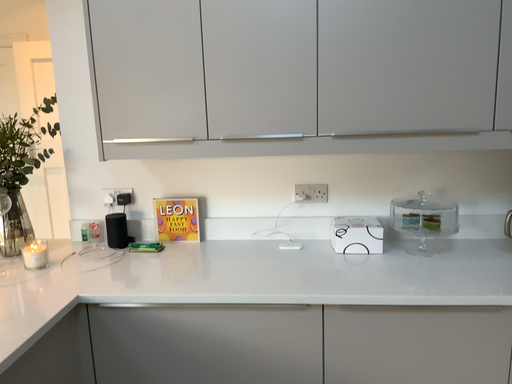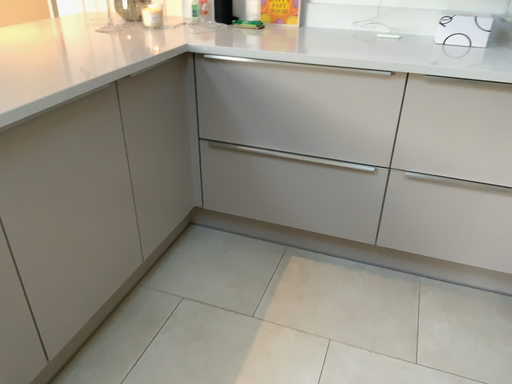
Question: Which way did the camera rotate in the video?

Choices:
 (A) rotated left
 (B) rotated right

Answer: (A)